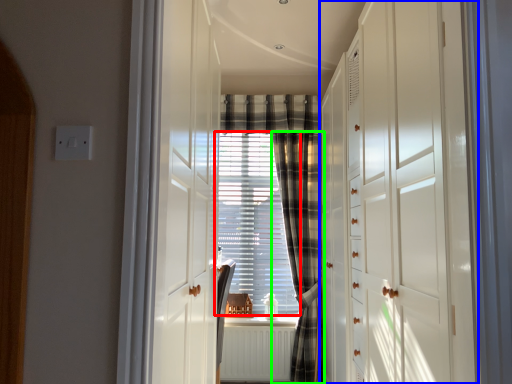
Question: Which object is the closest to the window screen (highlighted by a red box)? Choose among these: dresser (highlighted by a blue box) or curtain (highlighted by a green box).

Choices:
 (A) dresser
 (B) curtain

Answer: (B)